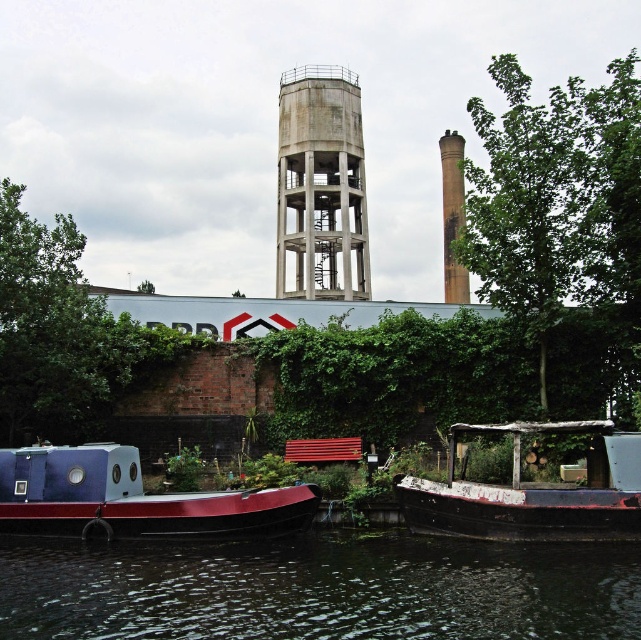
Can you confirm if dark green water at lower center is smaller than rusty wooden boat at lower right?

Correct, dark green water at lower center occupies less space than rusty wooden boat at lower right.

Does dark green water at lower center have a lesser height compared to rusty wooden boat at lower right?

Correct, dark green water at lower center is not as tall as rusty wooden boat at lower right.

Is point (424, 612) behind point (492, 493)?

That is False.

You are a GUI agent. You are given a task and a screenshot of the screen. Output one action in this format:
    pyautogui.click(x=<x>, y=<y>)
    Task: Click on the dark green water at lower center
    Image resolution: width=641 pixels, height=640 pixels.
    Given the screenshot: What is the action you would take?
    pyautogui.click(x=319, y=588)

Does point (53, 467) lie in front of point (440, 490)?

Yes, it is in front of point (440, 490).

Measure the distance between red polished wood boat at lower left and camera.

They are 108.69 feet apart.

Locate an element on the screen. The image size is (641, 640). red polished wood boat at lower left is located at coordinates (131, 499).

Where is `red polished wood boat at lower left`? The height and width of the screenshot is (640, 641). red polished wood boat at lower left is located at coordinates (131, 499).

Looking at this image, is dark green water at lower center to the left of brown textured chimney at upper right from the viewer's perspective?

Yes, dark green water at lower center is to the left of brown textured chimney at upper right.

Is dark green water at lower center shorter than brown textured chimney at upper right?

Yes, dark green water at lower center is shorter than brown textured chimney at upper right.

Which is in front, point (588, 570) or point (451, 292)?

Point (588, 570) is in front.

This screenshot has width=641, height=640. Find the location of `dark green water at lower center`. dark green water at lower center is located at coordinates (319, 588).